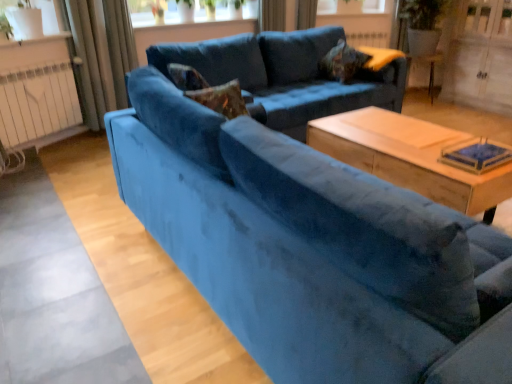
What are the coordinates of `free space above wooden coffee table at center (from a real-world perspective)` in the screenshot? It's located at (447, 148).